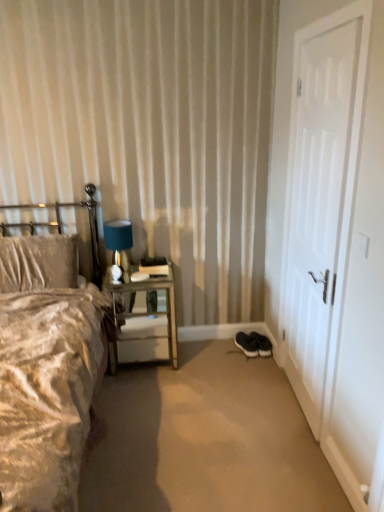
Find the location of `vacant space to the left of black suede sneakers at lower right, arranged as the 2th footwear when viewed from the right`. vacant space to the left of black suede sneakers at lower right, arranged as the 2th footwear when viewed from the right is located at coordinates (223, 346).